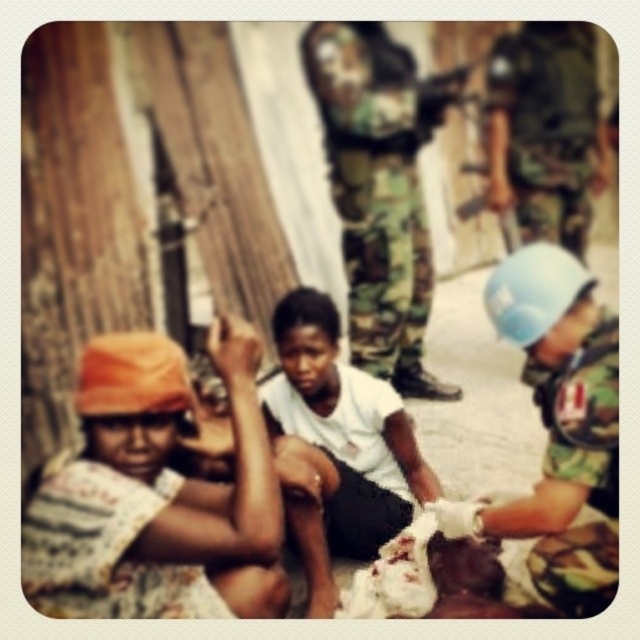
You are a photographer observing this scene. You notice the striped fabric headscarf at left and the camouflage uniform at right. Which object is closer to the bottom edge of the image?

The striped fabric headscarf at left is positioned under the camouflage uniform at right, meaning it is closer to the bottom edge of the image.

You are a drone operator trying to locate a specific object in the scene. The coordinates given are in the format x,y where the bottom left corner is the origin. Can you confirm if the woven fabric hat at lower left is positioned closer to the left edge of the image compared to its y coordinate?

The woven fabric hat at lower left is located at point (104, 547). Since the x coordinate is 0.856, which is closer to the right edge, it is not positioned closer to the left edge compared to its y coordinate.